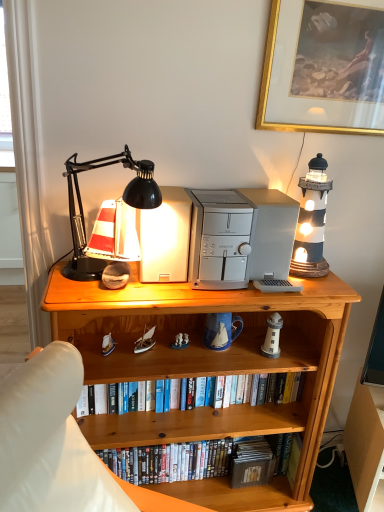
This screenshot has width=384, height=512. In order to click on blank space situated above wooden bookcase at center (from a real-world perspective) in this screenshot , I will do `click(213, 285)`.